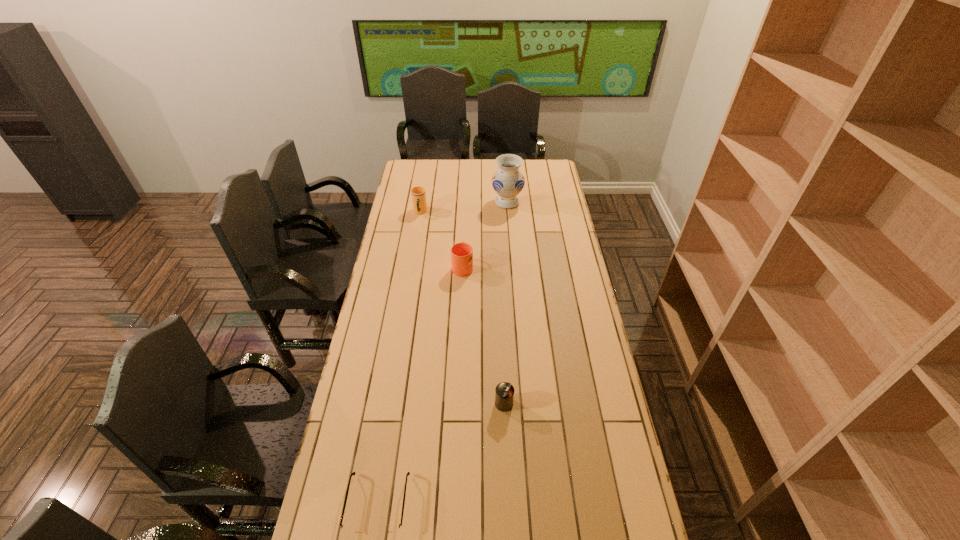
The width and height of the screenshot is (960, 540). Identify the location of free space that satisfies the following two spatial constraints: 1. on the side of the second nearest object with the handle; 2. on the left side of the cup. coord(388,403).

Locate an element on the screen. free spot that satisfies the following two spatial constraints: 1. on the handle side of the third nearest object; 2. on the left side of the vase is located at coordinates (466, 202).